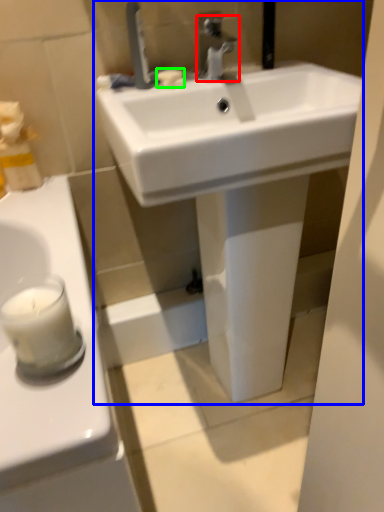
Question: Which is nearer to the tap (highlighted by a red box)? sink (highlighted by a blue box) or soap (highlighted by a green box).

Choices:
 (A) sink
 (B) soap

Answer: (B)